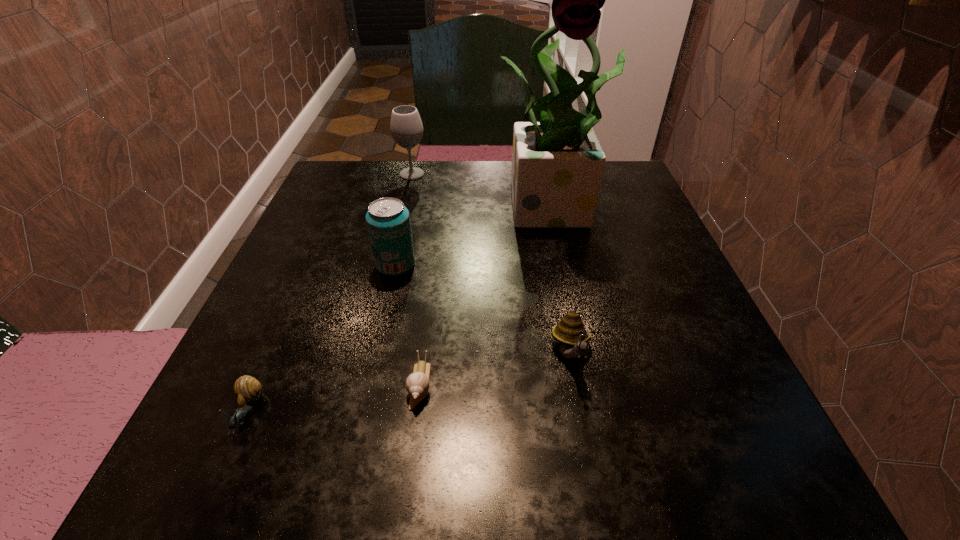
This screenshot has height=540, width=960. Find the location of `the tallest object`. the tallest object is located at coordinates (557, 163).

The image size is (960, 540). I want to click on the fifth shortest object, so click(x=406, y=128).

Find the location of a particular element. the third farthest object is located at coordinates (388, 221).

Where is `the fourth shortest object`? the fourth shortest object is located at coordinates (388, 221).

The image size is (960, 540). Find the location of `the third shortest object`. the third shortest object is located at coordinates (570, 332).

I want to click on the rightmost escargot, so click(570, 332).

This screenshot has height=540, width=960. Find the location of `the leftmost escargot`. the leftmost escargot is located at coordinates (247, 389).

The width and height of the screenshot is (960, 540). I want to click on the second shortest object, so click(247, 389).

The width and height of the screenshot is (960, 540). What are the coordinates of `the fourth object from left to right` in the screenshot? It's located at (417, 384).

Locate an element on the screen. the shortest object is located at coordinates (417, 384).